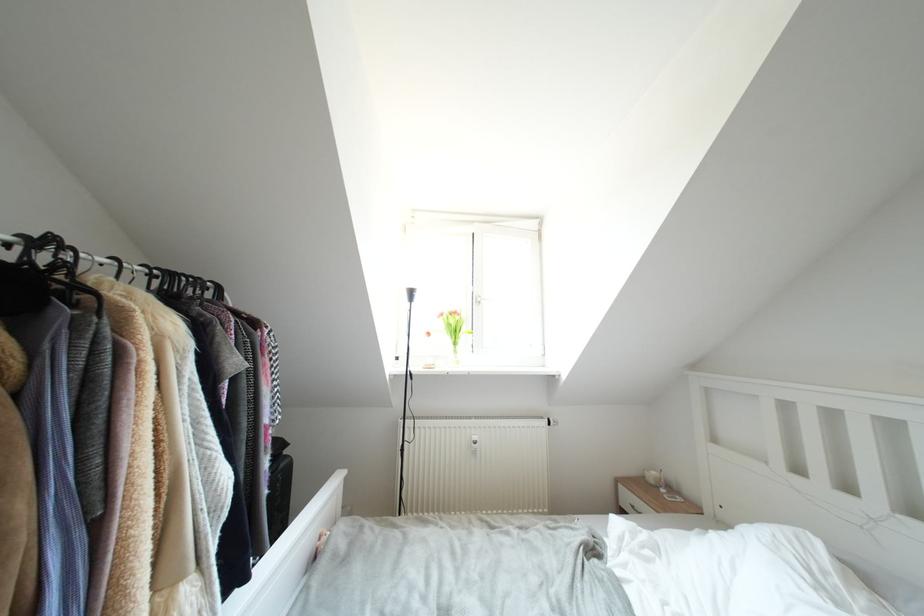
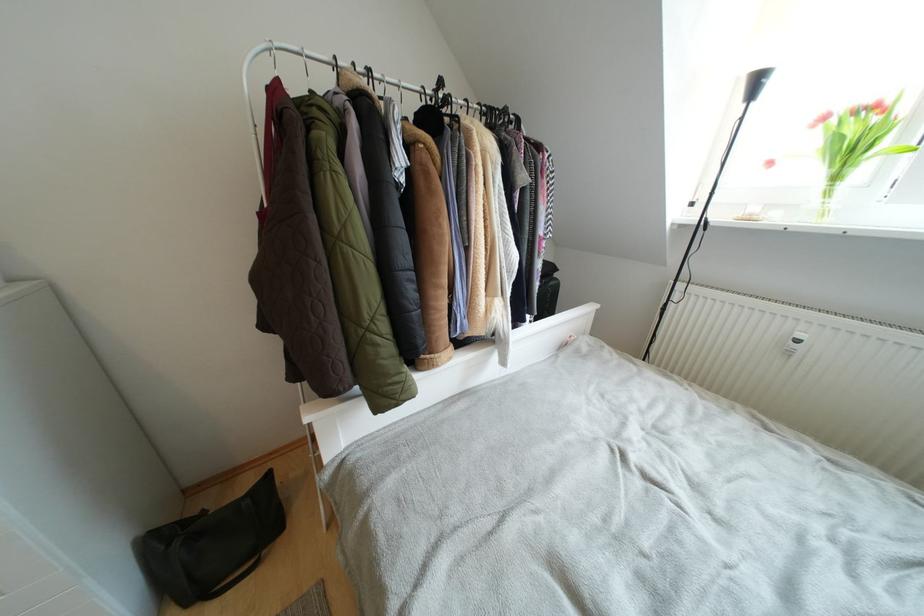
In the second image, find the point that corresponds to [480,442] in the first image.

(805, 339)